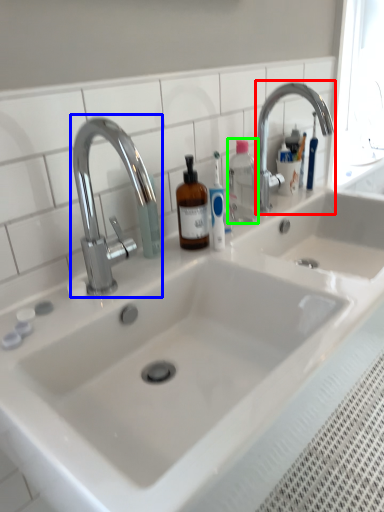
Question: Considering the real-world distances, which object is closest to tap (highlighted by a red box)? tap (highlighted by a blue box) or bottle (highlighted by a green box).

Choices:
 (A) tap
 (B) bottle

Answer: (B)